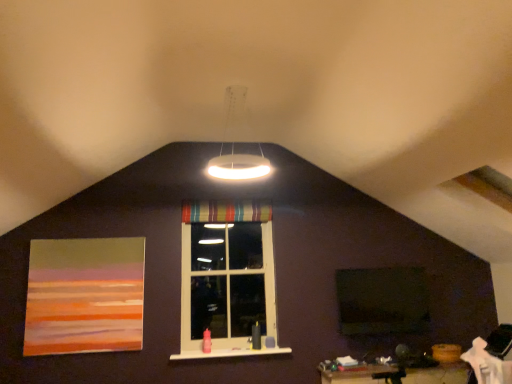
This screenshot has height=384, width=512. Identify the location of striped fabric window at center. 227,280.

At what (x,y) coordinates should I click in order to perform the action: click on green matte window screen at center. Please return your answer as a coordinate pair (x, y). Looking at the image, I should click on (382, 301).

Where is `striped fabric curtain at center`? This screenshot has height=384, width=512. striped fabric curtain at center is located at coordinates (225, 212).

Which object is positioned more to the right, striped fabric window at center or white glossy ring light at upper center?

white glossy ring light at upper center is more to the right.

Which object is thinner, striped fabric window at center or white glossy ring light at upper center?

striped fabric window at center.

Considering the relative positions of striped fabric window at center and white glossy ring light at upper center in the image provided, is striped fabric window at center in front of white glossy ring light at upper center?

That is False.

Identify the location of window lying behind the white glossy ring light at upper center. The height and width of the screenshot is (384, 512). (227, 280).

Is white glossy wood at center wider than striped fabric curtain at center?

Yes.

Can you confirm if white glossy wood at center is smaller than striped fabric curtain at center?

Yes, white glossy wood at center is smaller than striped fabric curtain at center.

Does white glossy wood at center come in front of striped fabric curtain at center?

Yes, white glossy wood at center is closer to the viewer.

Which point is more forward, (250, 354) or (229, 220)?

Point (250, 354)

From a real-world perspective, does striped fabric window at center stand above green matte window screen at center?

Yes.

Is striped fabric window at center to the left of green matte window screen at center from the viewer's perspective?

Correct, you'll find striped fabric window at center to the left of green matte window screen at center.

Considering the sizes of striped fabric window at center and green matte window screen at center in the image, is striped fabric window at center taller or shorter than green matte window screen at center?

Clearly, striped fabric window at center is taller compared to green matte window screen at center.

Considering the sizes of objects matte acrylic painting at left and green matte window screen at center in the image provided, who is taller, matte acrylic painting at left or green matte window screen at center?

Standing taller between the two is matte acrylic painting at left.

Is matte acrylic painting at left positioned in front of green matte window screen at center?

Yes, matte acrylic painting at left is closer to the viewer.

How many degrees apart are the facing directions of matte acrylic painting at left and green matte window screen at center?

They differ by 0.904 degrees in their facing directions.

In order to click on picture frame in front of the green matte window screen at center in this screenshot , I will do `click(84, 296)`.

Can you tell me how much green matte window screen at center and white glossy wood at center differ in facing direction?

0.369 degrees.

Is green matte window screen at center far from white glossy wood at center?

green matte window screen at center is far away from white glossy wood at center.

From the image's perspective, which one is positioned higher, green matte window screen at center or white glossy wood at center?

green matte window screen at center.

There is a white glossy wood at center. At what (x,y) coordinates should I click in order to perform the action: click on window above it (from a real-world perspective). Please return your answer as a coordinate pair (x, y). Looking at the image, I should click on (227, 280).

Which is more to the left, white glossy wood at center or striped fabric window at center?

From the viewer's perspective, striped fabric window at center appears more on the left side.

From a real-world perspective, is white glossy wood at center positioned above or below striped fabric window at center?

Clearly, from a real-world perspective, white glossy wood at center is below striped fabric window at center.

From the image's perspective, would you say white glossy wood at center is positioned over striped fabric window at center?

No.

Which point is more distant from viewer, (239, 350) or (348, 274)?

The point (348, 274) is more distant.

Based on their sizes in the image, would you say white glossy wood at center is bigger or smaller than green matte window screen at center?

Clearly, white glossy wood at center is smaller in size than green matte window screen at center.

From a real-world perspective, is white glossy wood at center positioned under green matte window screen at center based on gravity?

Correct, in the physical world, white glossy wood at center is lower than green matte window screen at center.

Is white glossy wood at center far from green matte window screen at center?

white glossy wood at center is far away from green matte window screen at center.

What are the coordinates of `window that appears on the left of white glossy ring light at upper center` in the screenshot? It's located at [x=227, y=280].

Locate an element on the screen. window sill below the striped fabric curtain at center (from the image's perspective) is located at coordinates (230, 353).

Looking at the image, which one is located further to white glossy wood at center, white glossy ring light at upper center or striped fabric window at center?

white glossy ring light at upper center.

When comparing their distances from striped fabric window at center, does matte acrylic painting at left or white glossy ring light at upper center seem closer?

Among the two, matte acrylic painting at left is located nearer to striped fabric window at center.

Looking at the image, which one is located further to green matte window screen at center, white glossy wood at center or white glossy ring light at upper center?

white glossy ring light at upper center is positioned further to the anchor green matte window screen at center.

When comparing their distances from striped fabric window at center, does striped fabric curtain at center or matte acrylic painting at left seem closer?

striped fabric curtain at center is closer to striped fabric window at center.

Considering their positions, is striped fabric curtain at center positioned closer to white glossy ring light at upper center than green matte window screen at center?

The object closer to white glossy ring light at upper center is striped fabric curtain at center.

When comparing their distances from white glossy wood at center, does green matte window screen at center or striped fabric curtain at center seem further?

Among the two, striped fabric curtain at center is located further to white glossy wood at center.

Consider the image. Considering their positions, is green matte window screen at center positioned further to white glossy wood at center than striped fabric window at center?

green matte window screen at center is positioned further to the anchor white glossy wood at center.

Looking at the image, which one is located further to green matte window screen at center, matte acrylic painting at left or striped fabric window at center?

Among the two, matte acrylic painting at left is located further to green matte window screen at center.

This screenshot has width=512, height=384. I want to click on window sill between striped fabric curtain at center and green matte window screen at center from left to right, so click(230, 353).

Locate an element on the screen. Image resolution: width=512 pixels, height=384 pixels. lamp between matte acrylic painting at left and green matte window screen at center from left to right is located at coordinates (234, 145).

Where is `curtain situated between matte acrylic painting at left and striped fabric window at center from left to right`? curtain situated between matte acrylic painting at left and striped fabric window at center from left to right is located at coordinates (225, 212).

I want to click on window between striped fabric curtain at center and white glossy wood at center from top to bottom, so click(x=227, y=280).